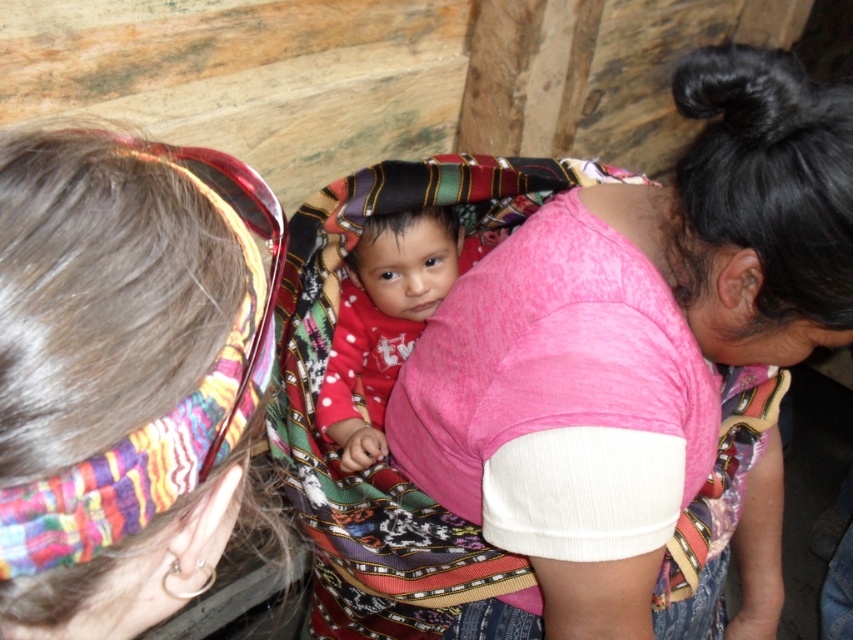
Question: Does pink fabric at center come behind multicolored woven cloth at upper center?

Choices:
 (A) yes
 (B) no

Answer: (A)

Question: Is pink fabric at center wider than multicolored woven cloth at upper center?

Choices:
 (A) yes
 (B) no

Answer: (A)

Question: Which object is positioned closest to the red polka dot fabric at center?

Choices:
 (A) pink fabric at center
 (B) multicolored woven cloth at upper center

Answer: (A)

Question: Is pink fabric at center bigger than red polka dot fabric at center?

Choices:
 (A) yes
 (B) no

Answer: (A)

Question: Based on their relative distances, which object is nearer to the red polka dot fabric at center?

Choices:
 (A) pink fabric at center
 (B) multicolored woven cloth at upper center

Answer: (A)

Question: Which object is the farthest from the multicolored woven cloth at upper center?

Choices:
 (A) red polka dot fabric at center
 (B) pink fabric at center

Answer: (A)